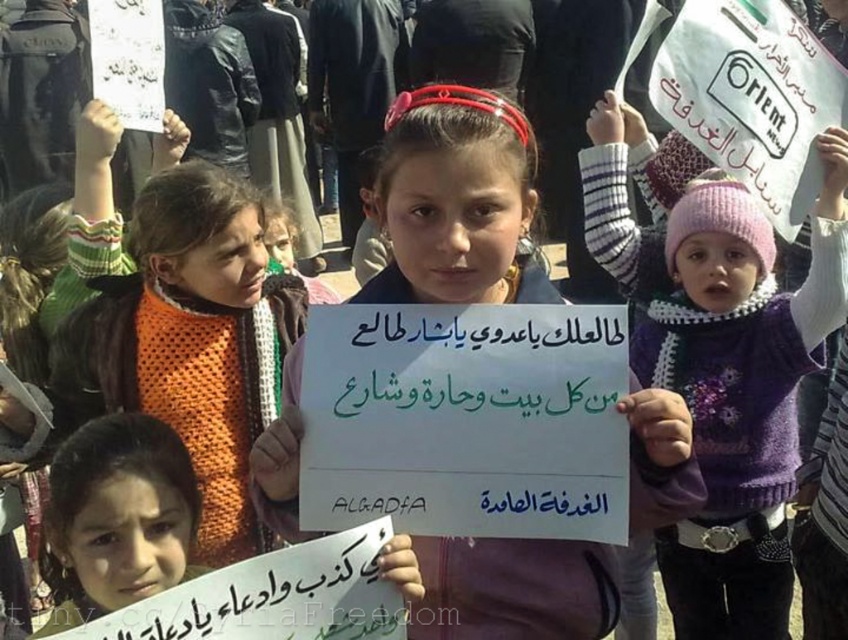
You are a fashion designer observing the protest scene. You notice the purple knitted sweater at center and the orange knitted sweater at upper left. Which sweater would be more suitable for a winter collection that prioritizes warmth and bulkiness?

The purple knitted sweater at center has a larger size compared to the orange knitted sweater at upper left, making it more suitable for a winter collection that prioritizes warmth and bulkiness due to its increased size and potential for thicker material.

You are a photographer trying to capture the protest scene. You notice the white paper sign at center and the orange knitted sweater at upper left. Which object should you focus on first to ensure both are in frame?

The white paper sign at center is located above the orange knitted sweater at upper left, so focusing on the sign first will ensure the sweater remains in frame below it.

What is located at the point with coordinates (721, 358) in the image?

The point with coordinates (721, 358) is on the purple knitted sweater at center.